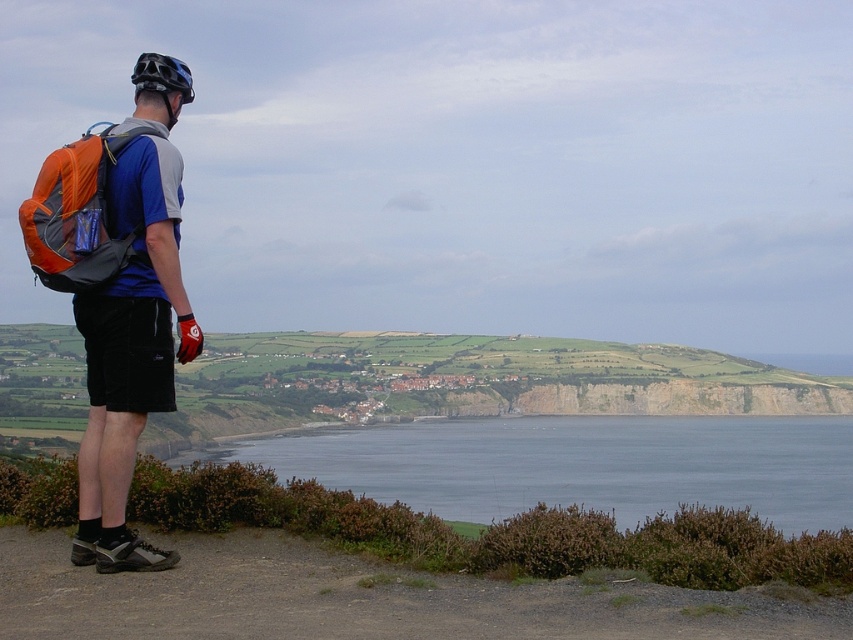
Can you confirm if orange fabric backpack at left is thinner than black matte helmet at upper left?

In fact, orange fabric backpack at left might be wider than black matte helmet at upper left.

Is orange fabric backpack at left further to camera compared to black matte helmet at upper left?

No, it is in front of black matte helmet at upper left.

Who is more forward, (x=141, y=257) or (x=154, y=90)?

Point (x=141, y=257) is in front.

What are the coordinates of `orange fabric backpack at left` in the screenshot? It's located at (78, 214).

Is matte orange backpack at left above orange fabric backpack at left?

No, matte orange backpack at left is not above orange fabric backpack at left.

Where is `matte orange backpack at left`? This screenshot has height=640, width=853. matte orange backpack at left is located at coordinates (132, 321).

Does matte orange backpack at left come in front of black matte helmet at upper left?

Yes, it is in front of black matte helmet at upper left.

Which is more to the left, matte orange backpack at left or black matte helmet at upper left?

black matte helmet at upper left is more to the left.

Where is `matte orange backpack at left`? This screenshot has width=853, height=640. matte orange backpack at left is located at coordinates (132, 321).